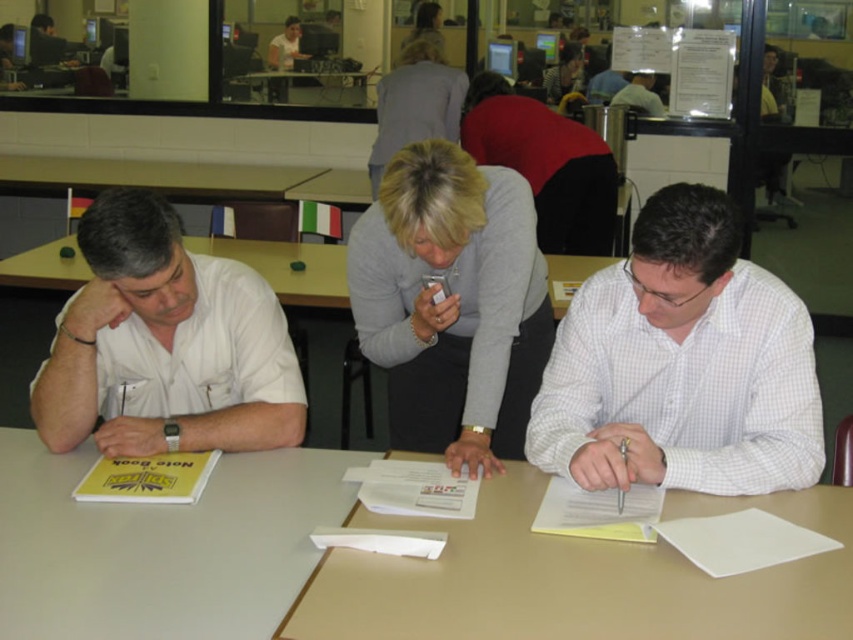
You are standing in the office and want to hand a form to the person wearing the gray fabric jacket at upper center and the smooth gray shirt at center. Which one can you reach without moving your position?

The gray fabric jacket at upper center is closer to the viewer than the smooth gray shirt at center, so you can reach the person wearing the gray fabric jacket at upper center without moving your position.

Based on the scene description, which object is shorter in height between the white checkered shirt at right and the gray sweater at center?

The white checkered shirt at right is shorter in height compared to the gray sweater at center according to the description.

You are an office worker who needs to determine which gray item is closer to the ceiling. You see a gray fabric jacket at upper center and a smooth gray shirt at center. Which one is closer to the ceiling?

The gray fabric jacket at upper center is positioned under the smooth gray shirt at center, so the smooth gray shirt at center is closer to the ceiling.